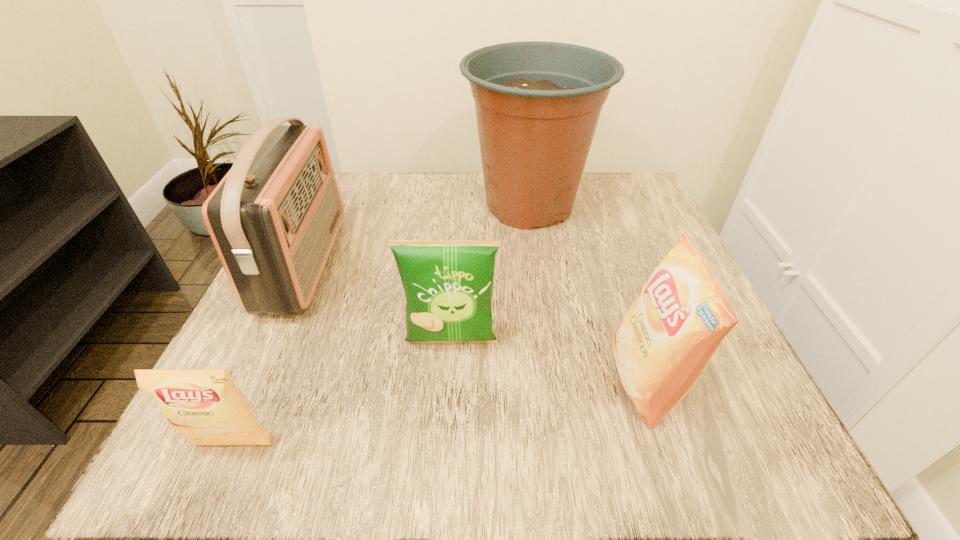
This screenshot has width=960, height=540. I want to click on free spot located 0.100m on the front-facing side of the rightmost crisp (potato chip), so click(546, 381).

The width and height of the screenshot is (960, 540). In order to click on free space located on the front-facing side of the second crisp (potato chip) from right to left in this screenshot , I will do `click(448, 382)`.

At what (x,y) coordinates should I click in order to perform the action: click on flowerpot that is at the far edge. Please return your answer as a coordinate pair (x, y). This screenshot has width=960, height=540. Looking at the image, I should click on (537, 104).

Where is `radio receiver present at the far edge`? radio receiver present at the far edge is located at coordinates (273, 219).

This screenshot has width=960, height=540. I want to click on radio receiver located in the left edge section of the desktop, so click(273, 219).

The height and width of the screenshot is (540, 960). Find the location of `crisp (potato chip) that is positioned at the left edge`. crisp (potato chip) that is positioned at the left edge is located at coordinates (206, 406).

Where is `flowerpot that is at the right edge`? flowerpot that is at the right edge is located at coordinates (537, 104).

You are a GUI agent. You are given a task and a screenshot of the screen. Output one action in this format:
    pyautogui.click(x=<x>, y=<y>)
    Task: Click on the crisp (potato chip) situated at the right edge
    
    Given the screenshot: What is the action you would take?
    pyautogui.click(x=664, y=342)

I want to click on object that is at the far left corner, so click(273, 219).

Where is `object at the near left corner`? object at the near left corner is located at coordinates (206, 406).